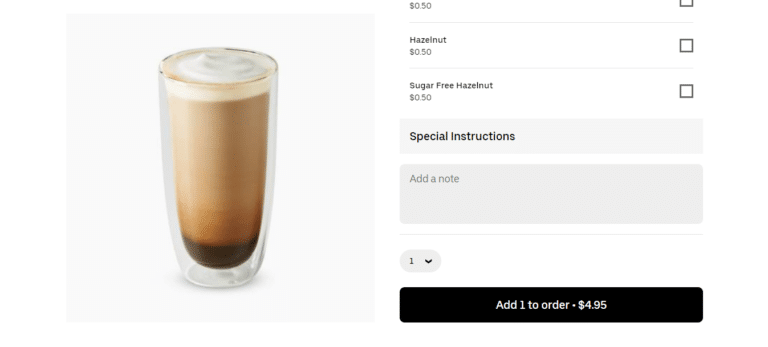
I want to click on rim of glass, so click(275, 69).